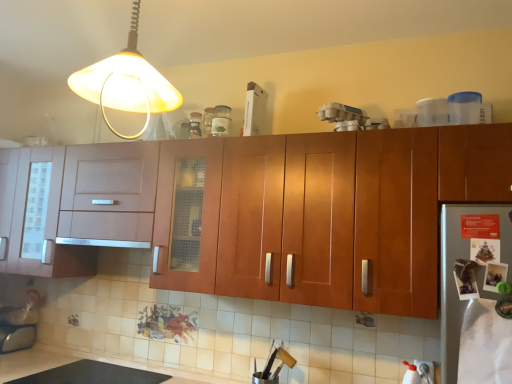
Question: Is matte glass bottle at upper center, acting as the 2th bottle starting from the right, looking in the opposite direction of matte yellow plastic lampshade at upper left?

Choices:
 (A) no
 (B) yes

Answer: (A)

Question: Is matte glass bottle at upper center, acting as the 2th bottle starting from the right, thinner than matte yellow plastic lampshade at upper left?

Choices:
 (A) no
 (B) yes

Answer: (B)

Question: Are matte glass bottle at upper center, acting as the 2th bottle starting from the right, and matte yellow plastic lampshade at upper left far apart?

Choices:
 (A) yes
 (B) no

Answer: (B)

Question: Considering the relative sizes of matte glass bottle at upper center, acting as the 2th bottle starting from the right, and matte yellow plastic lampshade at upper left in the image provided, is matte glass bottle at upper center, acting as the 2th bottle starting from the right, bigger than matte yellow plastic lampshade at upper left?

Choices:
 (A) no
 (B) yes

Answer: (A)

Question: Is matte yellow plastic lampshade at upper left a part of matte glass bottle at upper center, acting as the 2th bottle starting from the right?

Choices:
 (A) yes
 (B) no

Answer: (B)

Question: In terms of height, does matte yellow plastic lampshade at upper left look taller or shorter compared to clear glass jar at upper center, acting as the 2th bottle starting from the left?

Choices:
 (A) short
 (B) tall

Answer: (B)

Question: Is point (141, 81) positioned closer to the camera than point (216, 112)?

Choices:
 (A) closer
 (B) farther

Answer: (A)

Question: Do you think matte yellow plastic lampshade at upper left is within clear glass jar at upper center, acting as the 2th bottle starting from the left, or outside of it?

Choices:
 (A) outside
 (B) inside

Answer: (A)

Question: From the image's perspective, is matte yellow plastic lampshade at upper left positioned above or below clear glass jar at upper center, acting as the 2th bottle starting from the left?

Choices:
 (A) above
 (B) below

Answer: (A)

Question: Is matte glass bottle at upper center, which is the first bottle in left-to-right order, wider or thinner than satin silver exhaust hood at center?

Choices:
 (A) thin
 (B) wide

Answer: (A)

Question: Is matte glass bottle at upper center, which is the first bottle in left-to-right order, to the left or to the right of satin silver exhaust hood at center in the image?

Choices:
 (A) right
 (B) left

Answer: (A)

Question: Which is correct: matte glass bottle at upper center, acting as the 2th bottle starting from the right, is inside satin silver exhaust hood at center, or outside of it?

Choices:
 (A) inside
 (B) outside

Answer: (B)

Question: From a real-world perspective, is matte glass bottle at upper center, acting as the 2th bottle starting from the right, physically located above or below satin silver exhaust hood at center?

Choices:
 (A) above
 (B) below

Answer: (A)

Question: Looking at their shapes, would you say satin silver exhaust hood at center is wider or thinner than clear glass jar at upper center, acting as the 2th bottle starting from the left?

Choices:
 (A) thin
 (B) wide

Answer: (B)

Question: Considering the positions of satin silver exhaust hood at center and clear glass jar at upper center, which ranks as the 1th bottle in right-to-left order, in the image, is satin silver exhaust hood at center taller or shorter than clear glass jar at upper center, which ranks as the 1th bottle in right-to-left order,?

Choices:
 (A) short
 (B) tall

Answer: (A)